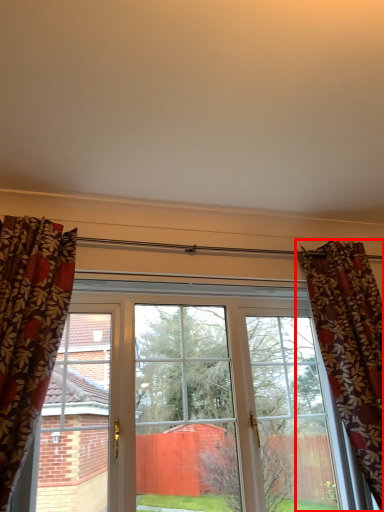
Question: From the image's perspective, where is curtain (annotated by the red box) located in relation to window in the image?

Choices:
 (A) below
 (B) above

Answer: (B)